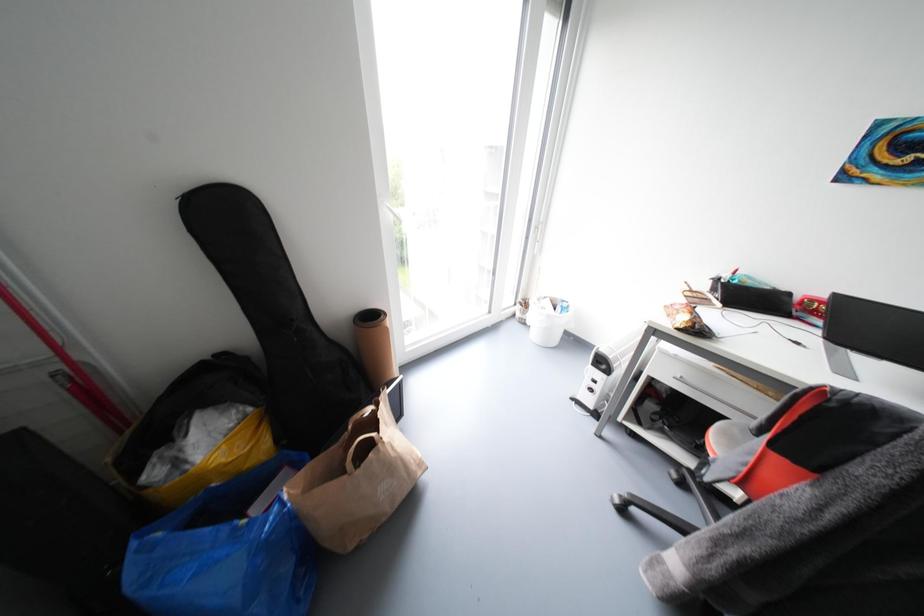
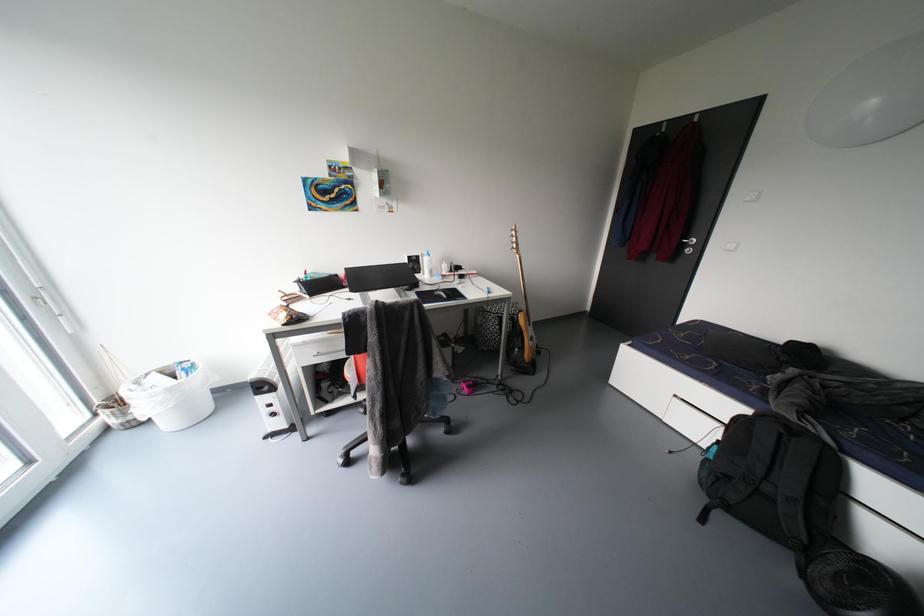
Question: The first image is from the beginning of the video and the second image is from the end. How did the camera likely rotate when shooting the video?

Choices:
 (A) Left
 (B) Right
 (C) Up
 (D) Down

Answer: (B)